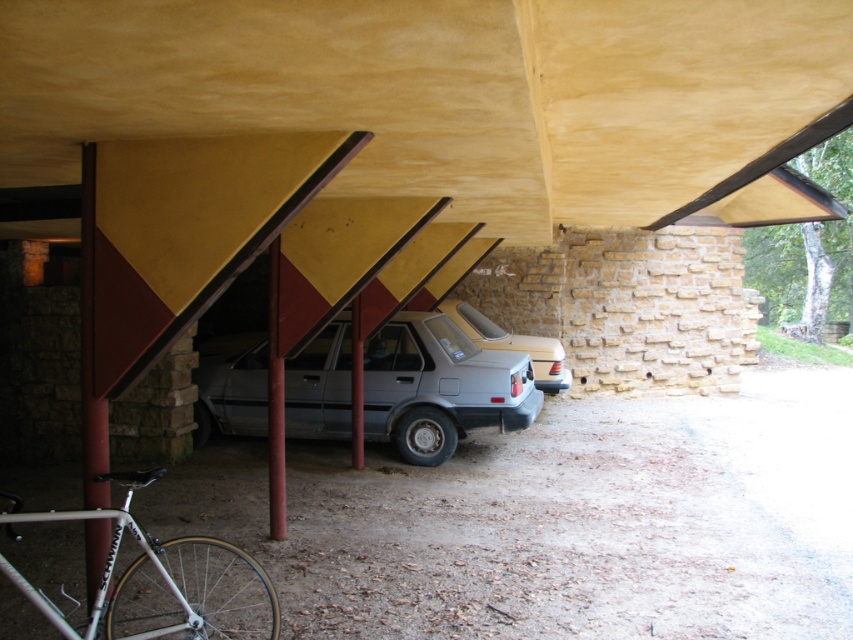
Can you confirm if silver metallic bicycle at lower left is positioned below silver metallic sedan at center?

Correct, silver metallic bicycle at lower left is located below silver metallic sedan at center.

Which of these two, silver metallic bicycle at lower left or silver metallic sedan at center, stands shorter?

Standing shorter between the two is silver metallic bicycle at lower left.

Between point (0, 557) and point (526, 337), which one is positioned in front?

Point (0, 557) is in front.

What are the coordinates of `silver metallic bicycle at lower left` in the screenshot? It's located at (160, 580).

Which is behind, point (193, 433) or point (537, 369)?

Positioned behind is point (537, 369).

Does point (369, 378) come in front of point (485, 333)?

Yes.

Where is `satin gray sedan at center`? The width and height of the screenshot is (853, 640). satin gray sedan at center is located at coordinates (439, 387).

Find the location of a particular element. satin gray sedan at center is located at coordinates (439, 387).

Who is more forward, (199, 387) or (114, 522)?

Point (114, 522) is more forward.

Image resolution: width=853 pixels, height=640 pixels. In order to click on satin gray sedan at center in this screenshot , I will do `click(439, 387)`.